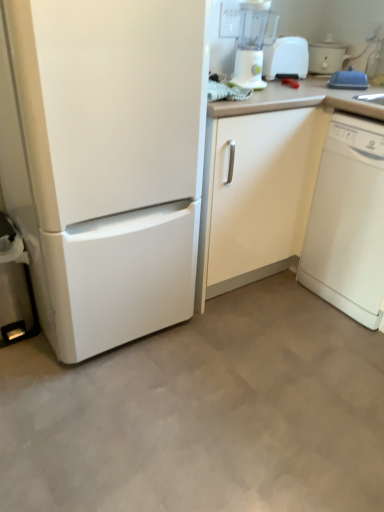
This screenshot has width=384, height=512. In order to click on white matte refrigerator at left in this screenshot , I will do `click(111, 163)`.

In order to face white matte refrigerator at left, should I rotate leftwards or rightwards?

To align with it, rotate left about 12.649°.

Find the location of a particular element. white glossy dishwasher at right is located at coordinates (348, 221).

What do you see at coordinates (326, 55) in the screenshot? This screenshot has height=512, width=384. I see `white plastic cooker at upper right` at bounding box center [326, 55].

What are the coordinates of `blue plastic lid at upper right` in the screenshot? It's located at (348, 79).

The image size is (384, 512). Find the location of `white plastic blender at upper right`. white plastic blender at upper right is located at coordinates (253, 42).

What do you see at coordinates (256, 196) in the screenshot? I see `white glossy cabinet at center` at bounding box center [256, 196].

Locate an element on the screen. The image size is (384, 512). white matte refrigerator at left is located at coordinates click(111, 163).

Can you confirm if white glossy dishwasher at right is thinner than white matte refrigerator at left?

Indeed, white glossy dishwasher at right has a lesser width compared to white matte refrigerator at left.

Does point (378, 167) come behind point (127, 256)?

Yes, it is.

From the image's perspective, which is above, white glossy dishwasher at right or white matte refrigerator at left?

white matte refrigerator at left, from the image's perspective.

Is white glossy dishwasher at right not near white plastic toaster at upper right?

No.

Is point (375, 258) positioned after point (275, 61)?

No, (375, 258) is closer to viewer.

Looking at this image, from the image's perspective, is white glossy dishwasher at right located above or below white plastic toaster at upper right?

Clearly, from the image's perspective, white glossy dishwasher at right is below white plastic toaster at upper right.

Does white glossy dishwasher at right have a larger size compared to white plastic toaster at upper right?

Indeed, white glossy dishwasher at right has a larger size compared to white plastic toaster at upper right.

Is white plastic cooker at upper right completely or partially outside of white plastic toaster at upper right?

Yes, white plastic cooker at upper right is located beyond the bounds of white plastic toaster at upper right.

In the scene shown: Is white plastic cooker at upper right placed right next to white plastic toaster at upper right?

There is a gap between white plastic cooker at upper right and white plastic toaster at upper right.

From the image's perspective, does white plastic cooker at upper right appear higher than white plastic toaster at upper right?

Correct, white plastic cooker at upper right appears higher than white plastic toaster at upper right in the image.

Considering their positions, is white plastic cooker at upper right located in front of or behind white plastic toaster at upper right?

white plastic cooker at upper right is behind white plastic toaster at upper right.

From a real-world perspective, is white plastic toaster at upper right above or below white glossy dishwasher at right?

From a real-world perspective, white plastic toaster at upper right is physically above white glossy dishwasher at right.

Can you tell me how much white plastic toaster at upper right and white glossy dishwasher at right differ in facing direction?

90 degrees.

Consider the image. Are white plastic toaster at upper right and white glossy dishwasher at right far apart?

white plastic toaster at upper right is actually quite close to white glossy dishwasher at right.

Which point is more forward, (301, 66) or (323, 243)?

Point (323, 243)

Which of these two, white glossy cabinet at center or blue plastic lid at upper right, stands taller?

With more height is white glossy cabinet at center.

Is point (296, 147) in front of point (367, 84)?

That is True.

Considering the sizes of objects white glossy cabinet at center and blue plastic lid at upper right in the image provided, who is smaller, white glossy cabinet at center or blue plastic lid at upper right?

With smaller size is blue plastic lid at upper right.

From the image's perspective, which object appears higher, white glossy cabinet at center or blue plastic lid at upper right?

From the image's view, blue plastic lid at upper right is above.

From a real-world perspective, is white glossy cabinet at center on top of white plastic cooker at upper right?

No, from a real-world perspective, white glossy cabinet at center is not over white plastic cooker at upper right

Is white glossy cabinet at center in contact with white plastic cooker at upper right?

No, white glossy cabinet at center is not making contact with white plastic cooker at upper right.

Is white glossy cabinet at center wider than white plastic cooker at upper right?

Yes.

What's the angular difference between blue plastic lid at upper right and white plastic blender at upper right's facing directions?

There is a 29.6-degree angle between the facing directions of blue plastic lid at upper right and white plastic blender at upper right.

Is blue plastic lid at upper right directly adjacent to white plastic blender at upper right?

blue plastic lid at upper right and white plastic blender at upper right are not in contact.

Based on their positions, is blue plastic lid at upper right located to the left or right of white plastic blender at upper right?

Based on their positions, blue plastic lid at upper right is located to the right of white plastic blender at upper right.

Is blue plastic lid at upper right inside the boundaries of white plastic blender at upper right, or outside?

blue plastic lid at upper right exists outside the volume of white plastic blender at upper right.

Find the location of a particular element. This screenshot has width=384, height=512. dish washer below the white matte refrigerator at left (from a real-world perspective) is located at coordinates (348, 221).

In order to click on dish washer to the right of white plastic toaster at upper right in this screenshot , I will do `click(348, 221)`.

Considering their positions, is white plastic toaster at upper right positioned closer to white plastic cooker at upper right than white matte refrigerator at left?

white plastic toaster at upper right is positioned closer to the anchor white plastic cooker at upper right.

Looking at this image, based on their spatial positions, is blue plastic lid at upper right or white plastic blender at upper right further from white plastic cooker at upper right?

The object further to white plastic cooker at upper right is white plastic blender at upper right.

Looking at the image, which one is located further to white glossy dishwasher at right, white glossy cabinet at center or blue plastic lid at upper right?

The object further to white glossy dishwasher at right is blue plastic lid at upper right.

When comparing their distances from white glossy dishwasher at right, does blue plastic lid at upper right or white plastic toaster at upper right seem closer?

blue plastic lid at upper right lies closer to white glossy dishwasher at right than the other object.

From the image, which object appears to be nearer to blue plastic lid at upper right, white matte refrigerator at left or white glossy dishwasher at right?

white glossy dishwasher at right lies closer to blue plastic lid at upper right than the other object.

Based on their spatial positions, is white glossy cabinet at center or white plastic toaster at upper right further from white matte refrigerator at left?

white plastic toaster at upper right is further to white matte refrigerator at left.

From the image, which object appears to be farther from white plastic cooker at upper right, white plastic toaster at upper right or white glossy cabinet at center?

Based on the image, white glossy cabinet at center appears to be further to white plastic cooker at upper right.

Based on their spatial positions, is white matte refrigerator at left or white plastic cooker at upper right closer to white glossy cabinet at center?

Among the two, white matte refrigerator at left is located nearer to white glossy cabinet at center.

This screenshot has height=512, width=384. Identify the location of blender between white matte refrigerator at left and white plastic toaster at upper right along the z-axis. (253, 42).

The width and height of the screenshot is (384, 512). In order to click on cabinetry between white plastic toaster at upper right and white glossy dishwasher at right in the vertical direction in this screenshot , I will do `click(256, 196)`.

Find the location of a particular element. blender between white plastic cooker at upper right and white glossy dishwasher at right vertically is located at coordinates (253, 42).

Image resolution: width=384 pixels, height=512 pixels. Identify the location of toaster between white plastic cooker at upper right and white glossy dishwasher at right vertically. (286, 58).